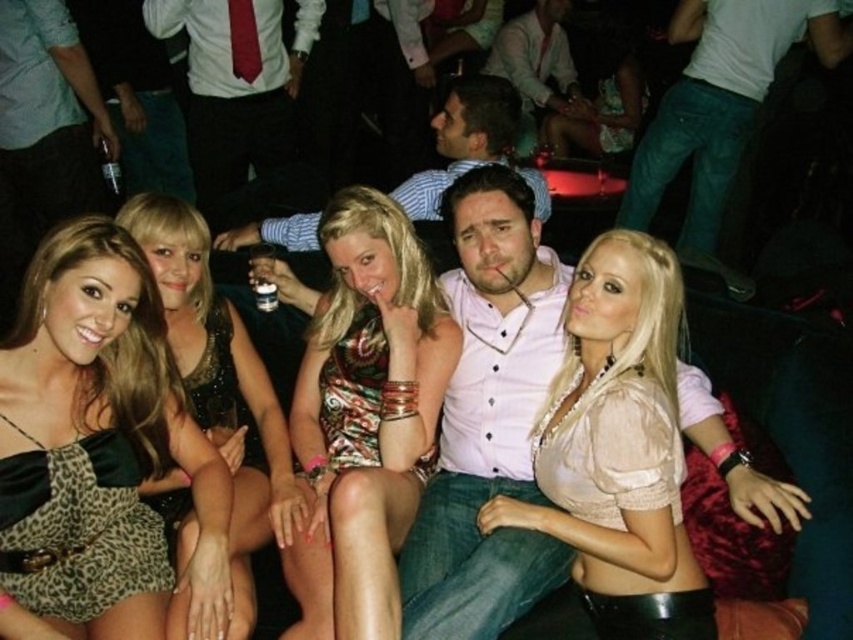
Is leopard print fabric dress at lower left taller than matte white shirt at center?

No.

What do you see at coordinates (78, 529) in the screenshot? This screenshot has height=640, width=853. I see `leopard print fabric dress at lower left` at bounding box center [78, 529].

Image resolution: width=853 pixels, height=640 pixels. Identify the location of leopard print fabric dress at lower left. (78, 529).

Based on the photo, can you confirm if printed silk dress at center is bigger than satin beige blouse at center?

Indeed, printed silk dress at center has a larger size compared to satin beige blouse at center.

Is the position of printed silk dress at center more distant than that of satin beige blouse at center?

No, printed silk dress at center is closer to the viewer.

Find the location of a particular element. printed silk dress at center is located at coordinates coord(364,417).

Locate an element on the screen. The height and width of the screenshot is (640, 853). printed silk dress at center is located at coordinates (364, 417).

Can you confirm if matte white shirt at center is positioned to the left of black sequined dress at center?

In fact, matte white shirt at center is to the right of black sequined dress at center.

Between point (523, 76) and point (253, 419), which one is positioned in front?

Point (253, 419)

Between point (561, 12) and point (209, 321), which one is positioned in front?

Point (209, 321)

At what (x,y) coordinates should I click in order to perform the action: click on matte white shirt at center. Please return your answer as a coordinate pair (x, y). Looking at the image, I should click on (535, 65).